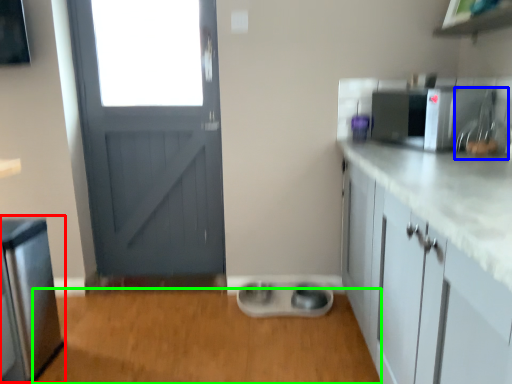
Question: Estimate the real-world distances between objects in this image. Which object is farther from appliance (highlighted by a red box), sink (highlighted by a blue box) or plain (highlighted by a green box)?

Choices:
 (A) sink
 (B) plain

Answer: (A)